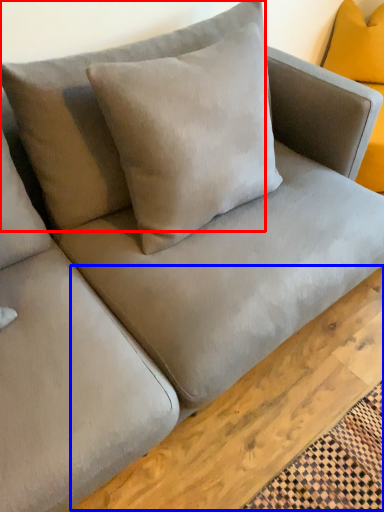
Question: Which object is closer to the camera taking this photo, pillow (highlighted by a red box) or plank (highlighted by a blue box)?

Choices:
 (A) pillow
 (B) plank

Answer: (A)